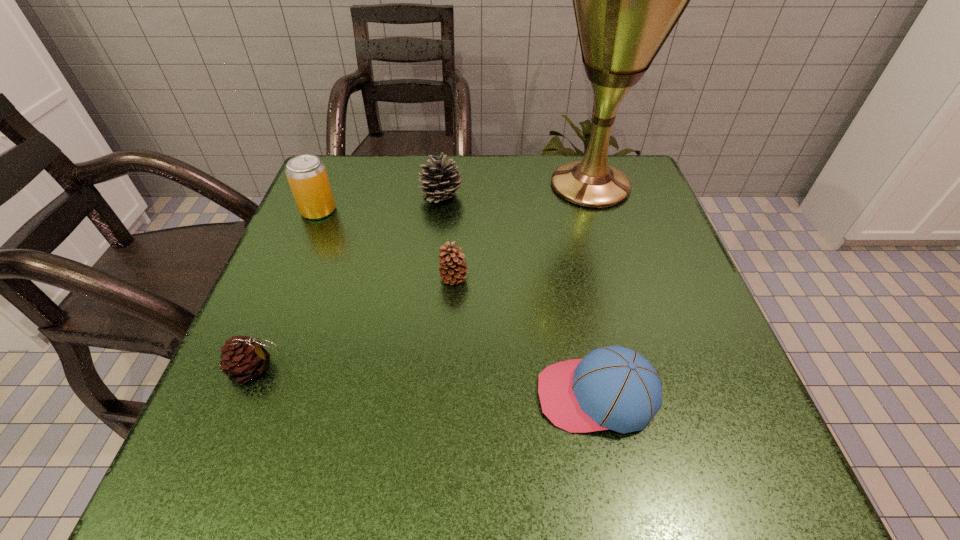
The height and width of the screenshot is (540, 960). What are the coordinates of `free location at the right edge of the desktop` in the screenshot? It's located at (619, 237).

You are a GUI agent. You are given a task and a screenshot of the screen. Output one action in this format:
    pyautogui.click(x=<x>, y=<y>)
    Task: Click on the vacant position at the far left corner of the desktop
    The image size is (960, 540).
    Given the screenshot: What is the action you would take?
    pyautogui.click(x=337, y=165)

At what (x,y) coordinates should I click in order to perform the action: click on vacant space at the near left corner of the desktop. Please return your answer as a coordinate pair (x, y). Looking at the image, I should click on (242, 463).

I want to click on vacant space at the far right corner of the desktop, so click(646, 199).

Where is `blank space at the near right corner of the desktop`? blank space at the near right corner of the desktop is located at coordinates [x=692, y=485].

At what (x,y) coordinates should I click in order to perform the action: click on free point between the shortest pinecone and the third tallest object. Please return your answer as a coordinate pair (x, y). This screenshot has height=540, width=960. Looking at the image, I should click on point(348,282).

At what (x,y) coordinates should I click in order to perform the action: click on vacant area that lies between the fourth shortest object and the fourth farthest object. Please return your answer as a coordinate pair (x, y). The height and width of the screenshot is (540, 960). Looking at the image, I should click on (447, 237).

The width and height of the screenshot is (960, 540). I want to click on vacant space that's between the second farthest pinecone and the farthest pinecone, so click(x=447, y=237).

Find the location of a particular element. The height and width of the screenshot is (540, 960). vacant space that is in between the farthest pinecone and the trophy cup is located at coordinates (516, 191).

This screenshot has width=960, height=540. I want to click on free space between the tallest object and the pop (soda), so click(x=454, y=198).